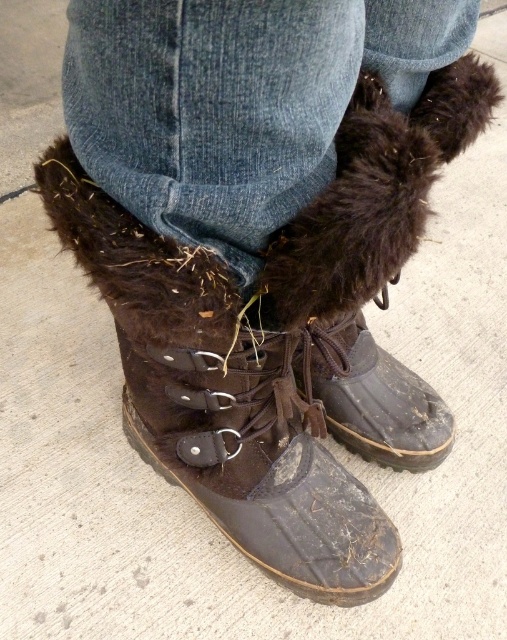
Question: Does brown suede boot at center have a lesser width compared to brown rubber boot at lower center?

Choices:
 (A) no
 (B) yes

Answer: (A)

Question: Is brown suede boot at center to the right of brown rubber boot at lower center from the viewer's perspective?

Choices:
 (A) no
 (B) yes

Answer: (A)

Question: Which point is farther from the camera taking this photo?

Choices:
 (A) (223, 358)
 (B) (424, 384)

Answer: (B)

Question: Can you confirm if brown suede boot at center is wider than brown rubber boot at lower center?

Choices:
 (A) no
 (B) yes

Answer: (B)